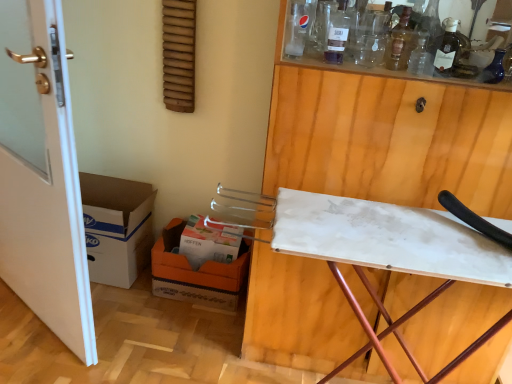
Question: Looking at their shapes, would you say white cardboard box at lower center is wider or thinner than white glossy door at left?

Choices:
 (A) thin
 (B) wide

Answer: (B)

Question: Is white cardboard box at lower center spatially inside white glossy door at left, or outside of it?

Choices:
 (A) outside
 (B) inside

Answer: (A)

Question: Which of these objects is positioned closest to the white glossy door at left?

Choices:
 (A) transparent glass bottle at upper center
 (B) white marble ironing board at upper right
 (C) white matte ironing board at lower right
 (D) orange cardboard box at lower left, which is counted as the first cardboard box, starting from the right
 (E) white cardboard box at lower center

Answer: (D)

Question: Estimate the real-world distances between objects in this image. Which object is closer to the orange cardboard box at lower left, which is counted as the second cardboard box, starting from the left?

Choices:
 (A) white cardboard box at lower center
 (B) transparent glass bottle at upper center
 (C) translucent glass bottle at upper right, the 2th wine bottle viewed from the right
 (D) white glossy door at left
 (E) white matte ironing board at lower right

Answer: (A)